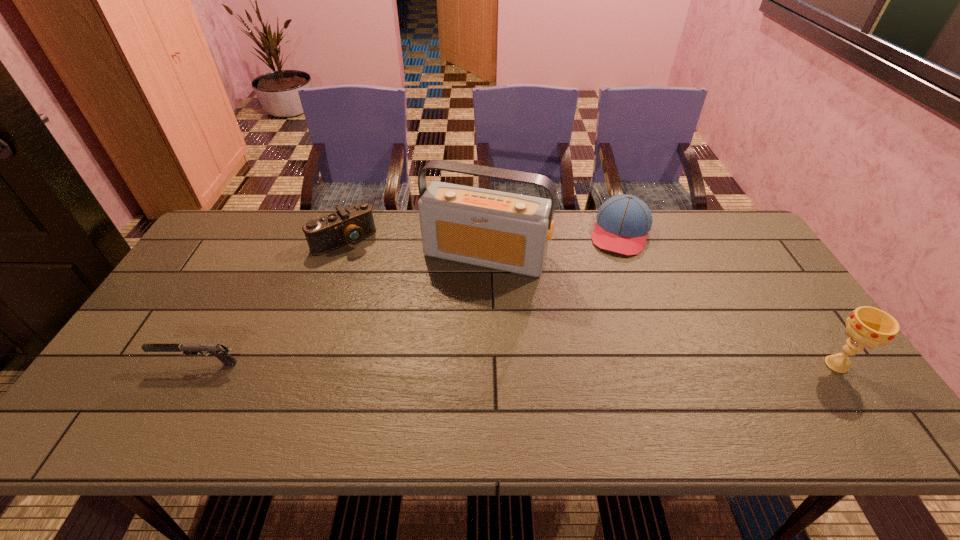
Locate an element on the screen. vacant area situated on the left of the second tallest object is located at coordinates (701, 364).

Image resolution: width=960 pixels, height=540 pixels. Find the location of `vacant space located on the front-facing side of the radio receiver`. vacant space located on the front-facing side of the radio receiver is located at coordinates (427, 368).

Locate an element on the screen. vacant space located on the front-facing side of the radio receiver is located at coordinates (448, 320).

Identify the location of blank space located 0.240m on the front-facing side of the radio receiver. (440, 340).

Where is `vacant space located 0.280m on the front-facing side of the baseball cap`? This screenshot has width=960, height=540. vacant space located 0.280m on the front-facing side of the baseball cap is located at coordinates (597, 318).

Locate an element on the screen. blank area located 0.100m on the front-facing side of the baseball cap is located at coordinates (610, 276).

Where is `vacant space located 0.210m on the front-facing side of the baseball cap`? vacant space located 0.210m on the front-facing side of the baseball cap is located at coordinates (602, 301).

What are the coordinates of `vacant point located on the lens of the camera` in the screenshot? It's located at coord(412,319).

You are a GUI agent. You are given a task and a screenshot of the screen. Output one action in this format:
    pyautogui.click(x=<x>, y=<y>)
    Task: Click on the free space located 0.200m on the lens of the camera
    
    Given the screenshot: What is the action you would take?
    pyautogui.click(x=388, y=289)

Identify the location of vacant area situated 0.050m on the lens of the camera. The height and width of the screenshot is (540, 960). tap(365, 261).